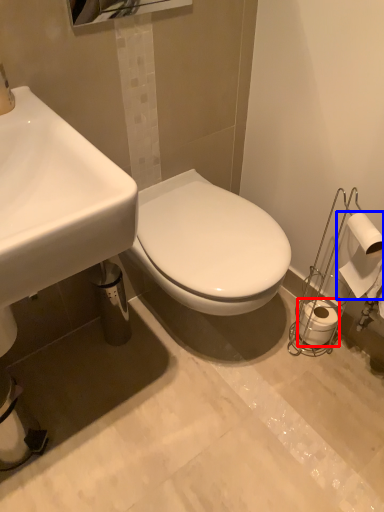
Question: Which object is further to the camera taking this photo, toilet paper (highlighted by a red box) or toilet paper (highlighted by a blue box)?

Choices:
 (A) toilet paper
 (B) toilet paper

Answer: (A)